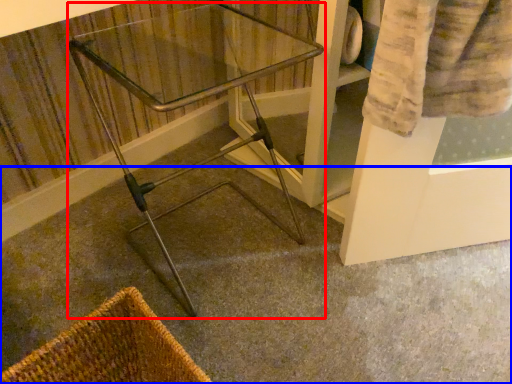
Question: Among these objects, which one is farthest to the camera, furniture (highlighted by a red box) or concrete (highlighted by a blue box)?

Choices:
 (A) furniture
 (B) concrete

Answer: (A)